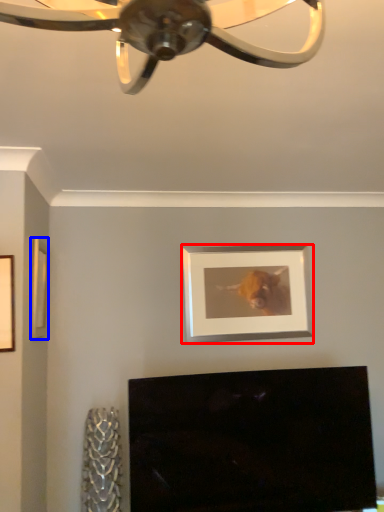
Question: Which object is closer to the camera taking this photo, picture frame (highlighted by a red box) or picture frame (highlighted by a blue box)?

Choices:
 (A) picture frame
 (B) picture frame

Answer: (B)